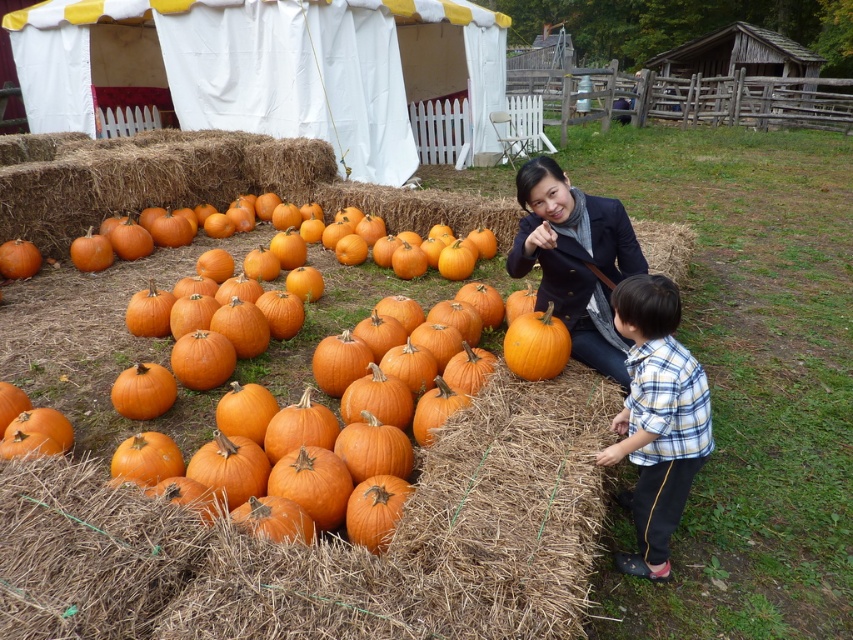
You are standing at the center of the pumpkin patch. You need to locate the orange matte pumpkin at center. What are its coordinates?

The orange matte pumpkin at center is located at coordinates 0.539 on the x axis and 0.630 on the y axis.